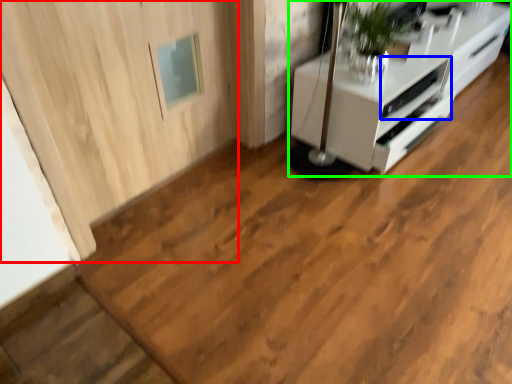
Question: Which object is the farthest from door (highlighted by a red box)? Choose among these: appliance (highlighted by a blue box) or furniture (highlighted by a green box).

Choices:
 (A) appliance
 (B) furniture

Answer: (A)